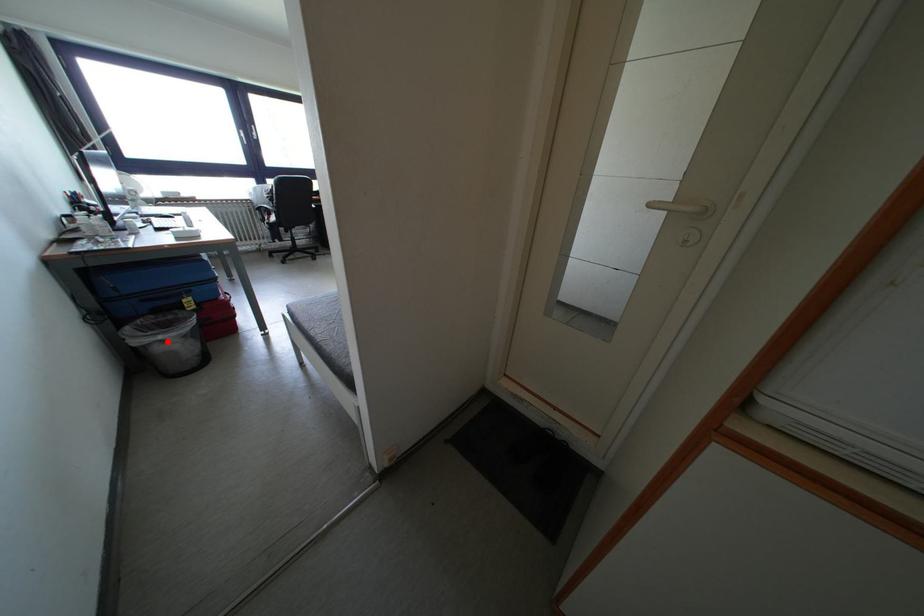
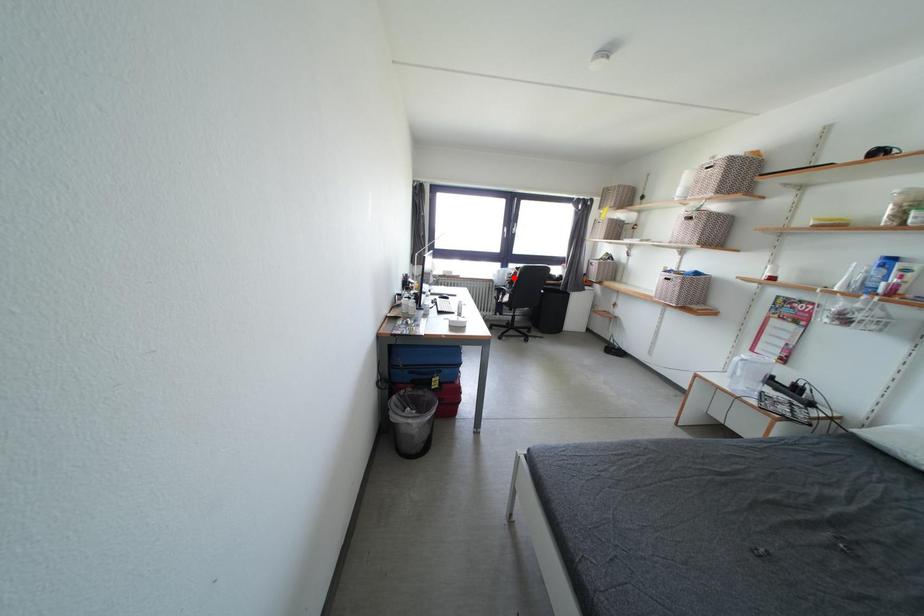
I am providing you with two images of the same scene from different viewpoints. A red point is marked on the first image and another point is marked on the second image. Does the point marked in image1 correspond to the same location as the one in image2?

No